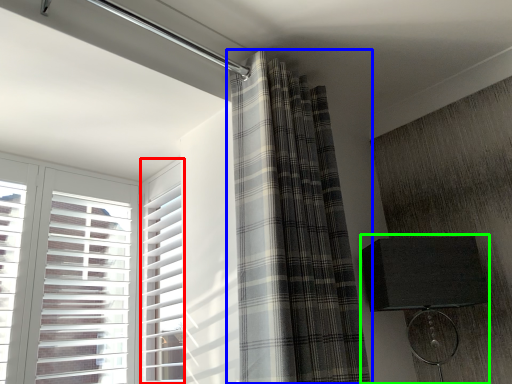
Question: Estimate the real-world distances between objects in this image. Which object is closer to window frame (highlighted by a red box), curtain (highlighted by a blue box) or table lamp (highlighted by a green box)?

Choices:
 (A) curtain
 (B) table lamp

Answer: (A)